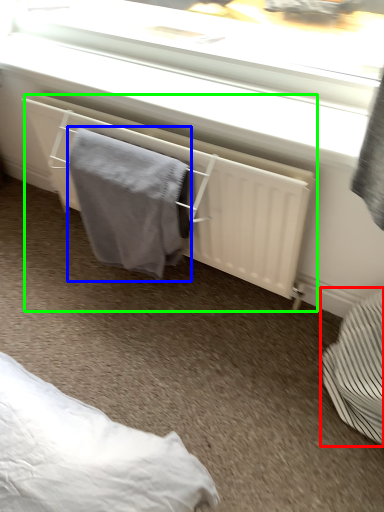
Question: Which is farther away from furniture (highlighted by a red box)? bath towel (highlighted by a blue box) or radiator (highlighted by a green box)?

Choices:
 (A) bath towel
 (B) radiator

Answer: (A)